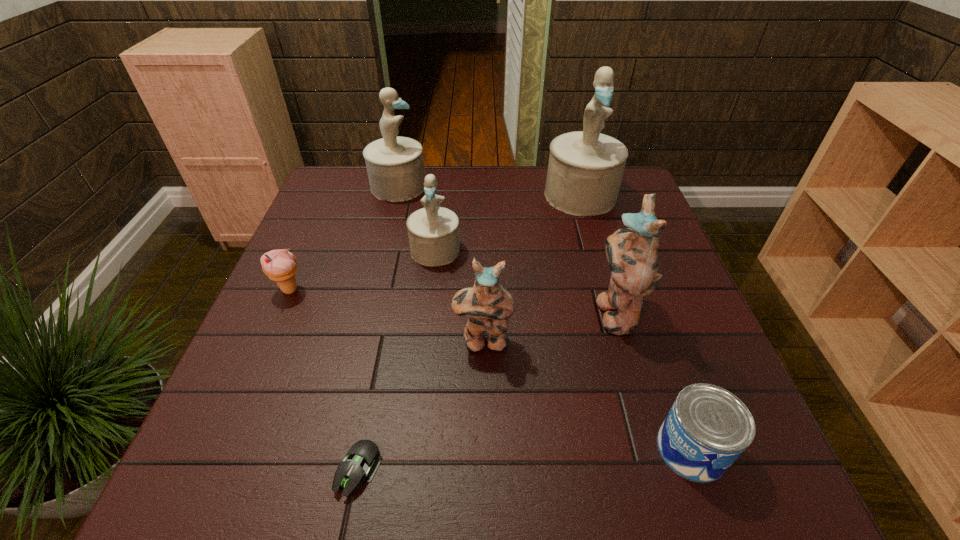
Locate an element on the screen. Image resolution: width=960 pixels, height=540 pixels. free space between the icecream and the second smallest white figurine is located at coordinates (344, 238).

Identify the location of empty space that is in between the left pink figurine and the biggest white figurine. This screenshot has height=540, width=960. (532, 268).

Image resolution: width=960 pixels, height=540 pixels. Find the location of `free point between the blue can and the bigger pink figurine`. free point between the blue can and the bigger pink figurine is located at coordinates (653, 380).

Find the location of a particular element. This screenshot has height=540, width=960. vacant point located between the tallest figurine and the third farthest figurine is located at coordinates (508, 222).

Locate an element on the screen. empty location between the third farthest figurine and the shortest object is located at coordinates (397, 360).

Locate which object is the fifth closest to the icecream. Please provide its 2D coordinates. Your answer should be formatted as a tuple, i.e. [(x, y)], where the tuple contains the x and y coordinates of a point satisfying the conditions above.

[(585, 169)]

Identify which object is the second nearest to the nearest white figurine. Please provide its 2D coordinates. Your answer should be formatted as a tuple, i.e. [(x, y)], where the tuple contains the x and y coordinates of a point satisfying the conditions above.

[(488, 305)]

Select which figurine appears as the third closest to the smaller pink figurine. Please provide its 2D coordinates. Your answer should be formatted as a tuple, i.e. [(x, y)], where the tuple contains the x and y coordinates of a point satisfying the conditions above.

[(585, 169)]

At what (x,y) coordinates should I click in order to perform the action: click on figurine identified as the closest to the right pink figurine. Please return your answer as a coordinate pair (x, y). The width and height of the screenshot is (960, 540). Looking at the image, I should click on (488, 305).

Choose which white figurine is the nearest neighbor to the icecream. Please provide its 2D coordinates. Your answer should be formatted as a tuple, i.e. [(x, y)], where the tuple contains the x and y coordinates of a point satisfying the conditions above.

[(433, 231)]